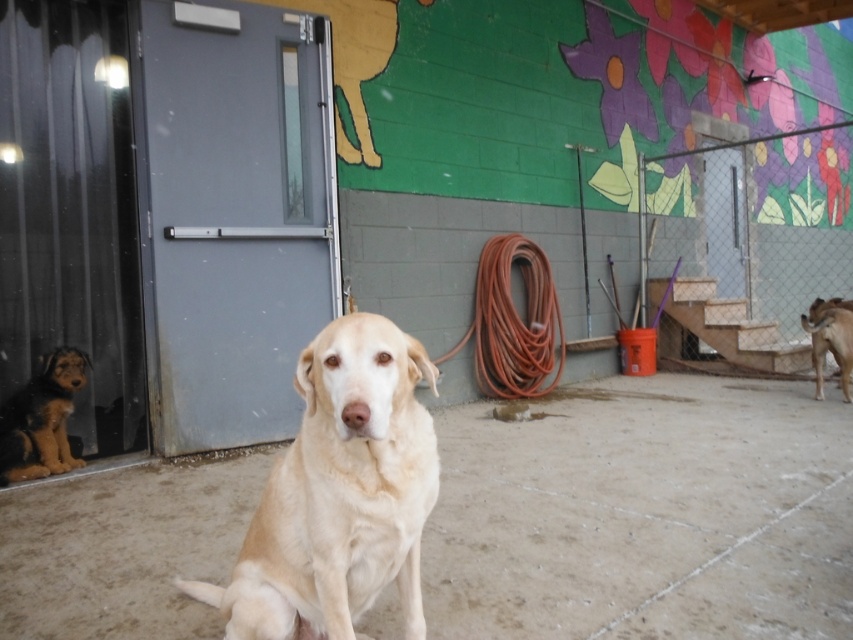
Question: Which object is farther from the camera taking this photo?

Choices:
 (A) rubber hose at center
 (B) light beige fur at center
 (C) brown fur puppy at left

Answer: (A)

Question: Can you confirm if rubber hose at center is smaller than brown fur puppy at left?

Choices:
 (A) no
 (B) yes

Answer: (A)

Question: Which of these objects is positioned farthest from the golden fur dog at right?

Choices:
 (A) light beige fur at center
 (B) brown fur puppy at left

Answer: (B)

Question: Is brown fur puppy at left bigger than golden fur dog at right?

Choices:
 (A) no
 (B) yes

Answer: (A)

Question: Can you confirm if rubber hose at center is bigger than brown fur puppy at left?

Choices:
 (A) yes
 (B) no

Answer: (A)

Question: Which is farther from the rubber hose at center?

Choices:
 (A) golden fur dog at right
 (B) light beige fur at center

Answer: (B)